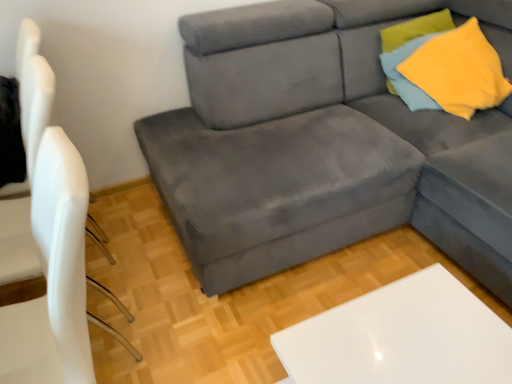
Question: From the image's perspective, would you say white matte chair at left is positioned over velvet gray couch at center?

Choices:
 (A) yes
 (B) no

Answer: (B)

Question: Does white matte chair at left turn towards velvet gray couch at center?

Choices:
 (A) yes
 (B) no

Answer: (B)

Question: From the image's perspective, does white matte chair at left appear lower than velvet gray couch at center?

Choices:
 (A) no
 (B) yes

Answer: (B)

Question: From a real-world perspective, is white matte chair at left located higher than velvet gray couch at center?

Choices:
 (A) no
 (B) yes

Answer: (B)

Question: Can you see white matte chair at left touching velvet gray couch at center?

Choices:
 (A) yes
 (B) no

Answer: (B)

Question: From the image's perspective, is yellow soft fabric pillow at upper right positioned above or below velvet gray couch at center?

Choices:
 (A) below
 (B) above

Answer: (B)

Question: Looking at the image, does yellow soft fabric pillow at upper right seem bigger or smaller compared to velvet gray couch at center?

Choices:
 (A) small
 (B) big

Answer: (A)

Question: Is point (431, 16) positioned closer to the camera than point (181, 203)?

Choices:
 (A) closer
 (B) farther

Answer: (B)

Question: Considering the positions of yellow soft fabric pillow at upper right and velvet gray couch at center in the image, is yellow soft fabric pillow at upper right taller or shorter than velvet gray couch at center?

Choices:
 (A) short
 (B) tall

Answer: (A)

Question: Would you say white matte chair at left is to the left or to the right of yellow soft fabric pillow at upper right in the picture?

Choices:
 (A) left
 (B) right

Answer: (A)

Question: In the image, is white matte chair at left positioned in front of or behind yellow soft fabric pillow at upper right?

Choices:
 (A) front
 (B) behind

Answer: (A)

Question: From their relative heights in the image, would you say white matte chair at left is taller or shorter than yellow soft fabric pillow at upper right?

Choices:
 (A) short
 (B) tall

Answer: (B)

Question: Considering the positions of white matte chair at left and yellow soft fabric pillow at upper right in the image, is white matte chair at left wider or thinner than yellow soft fabric pillow at upper right?

Choices:
 (A) wide
 (B) thin

Answer: (A)

Question: Is white matte chair at left inside the boundaries of white glossy table at lower right, or outside?

Choices:
 (A) inside
 (B) outside

Answer: (B)

Question: From their relative heights in the image, would you say white matte chair at left is taller or shorter than white glossy table at lower right?

Choices:
 (A) short
 (B) tall

Answer: (B)